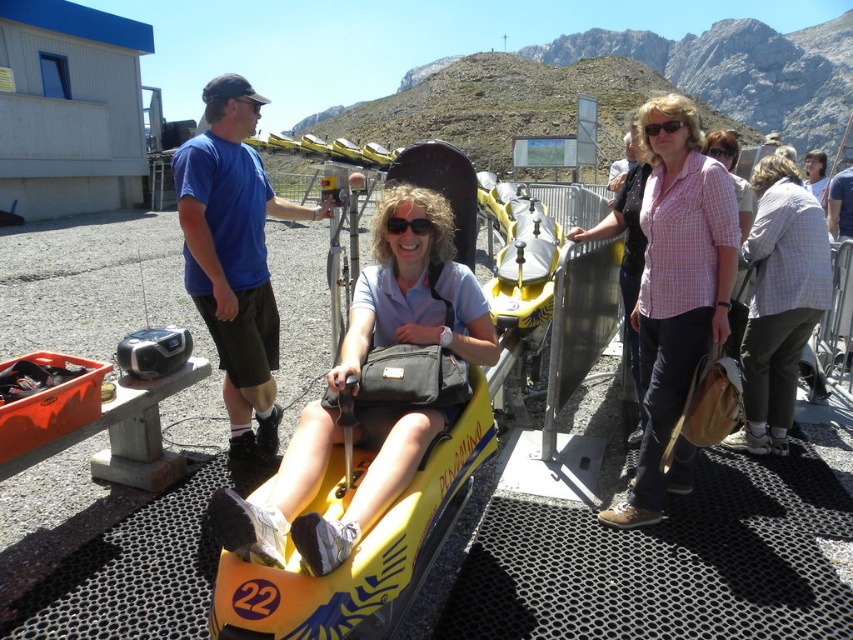
Question: Which is farther from the pink checkered shirt at center?

Choices:
 (A) transparent plastic goggles at center
 (B) matte pink shirt at center

Answer: (B)

Question: Which point appears closest to the camera in this image?

Choices:
 (A) (654, 124)
 (B) (390, 230)

Answer: (B)

Question: Can you confirm if matte pink shirt at center is positioned to the right of black matte goggles at center?

Choices:
 (A) yes
 (B) no

Answer: (A)

Question: Does blue cotton shirt at left appear over checkered shirt at center?

Choices:
 (A) yes
 (B) no

Answer: (A)

Question: Which of these objects is positioned closest to the black matte goggles at center?

Choices:
 (A) checkered shirt at center
 (B) black matte goggles at upper center
 (C) transparent plastic goggles at center
 (D) blue cotton shirt at left

Answer: (D)

Question: Does blue cotton shirt at left have a larger size compared to black matte goggles at upper center?

Choices:
 (A) no
 (B) yes

Answer: (A)